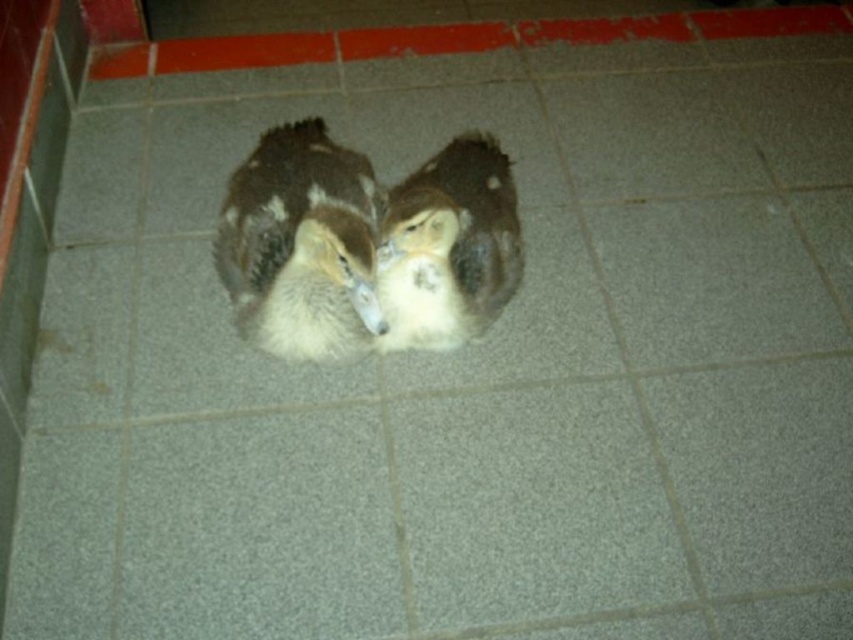
Question: Does brown fuzzy duck at center have a greater width compared to white fluffy duck at center?

Choices:
 (A) no
 (B) yes

Answer: (B)

Question: Which of the following is the closest to the observer?

Choices:
 (A) brown fuzzy duck at center
 (B) white fluffy duck at center

Answer: (A)

Question: Is brown fuzzy duck at center in front of white fluffy duck at center?

Choices:
 (A) yes
 (B) no

Answer: (A)

Question: Is brown fuzzy duck at center below white fluffy duck at center?

Choices:
 (A) yes
 (B) no

Answer: (A)

Question: Which of the following is the farthest from the observer?

Choices:
 (A) (345, 150)
 (B) (376, 289)

Answer: (A)